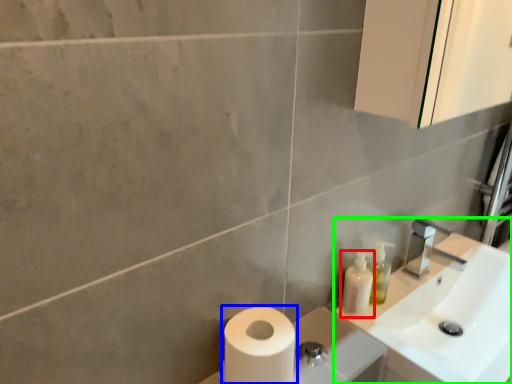
Question: Which is nearer to the toiletry (highlighted by a red box)? toilet paper (highlighted by a blue box) or sink (highlighted by a green box).

Choices:
 (A) toilet paper
 (B) sink

Answer: (B)